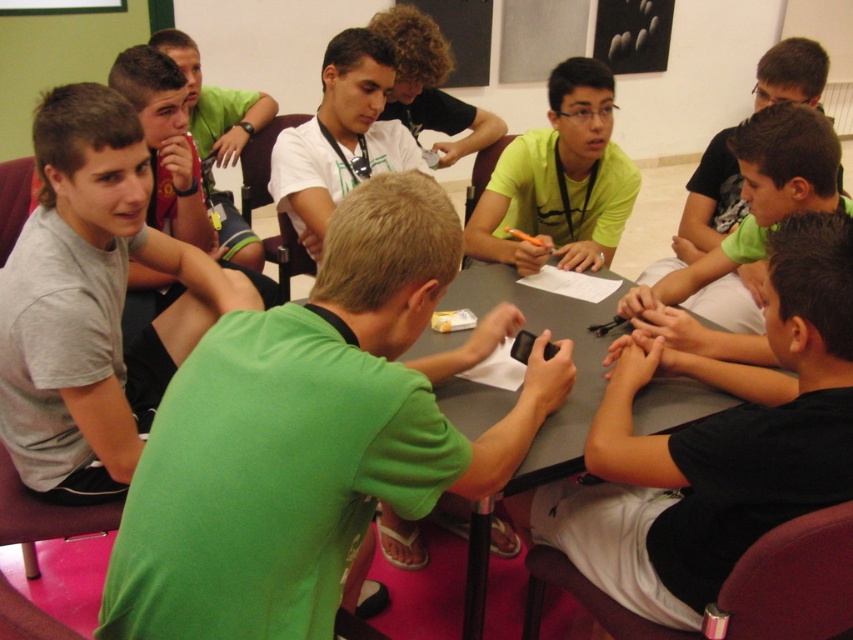
Question: Observing the image, what is the correct spatial positioning of white matte shirt at center in reference to curly-haired boy at upper center?

Choices:
 (A) above
 (B) below

Answer: (B)

Question: Estimate the real-world distances between objects in this image. Which object is farther from the smooth gray table at center?

Choices:
 (A) black matte phone at center
 (B) gray cotton shirt at left

Answer: (B)

Question: Does smooth gray table at center come behind matte green shirt at upper left?

Choices:
 (A) yes
 (B) no

Answer: (B)

Question: Estimate the real-world distances between objects in this image. Which object is closer to the black matte phone at center?

Choices:
 (A) curly-haired boy at upper center
 (B) gray cotton shirt at left
 (C) white matte shirt at center
 (D) matte green shirt at upper left

Answer: (B)

Question: Does black matte shirt at upper right have a smaller size compared to matte green shirt at upper left?

Choices:
 (A) yes
 (B) no

Answer: (B)

Question: Among these objects, which one is nearest to the camera?

Choices:
 (A) white matte shirt at center
 (B) green matte shirt at center
 (C) gray cotton shirt at left
 (D) yellow matte shirt at center

Answer: (B)